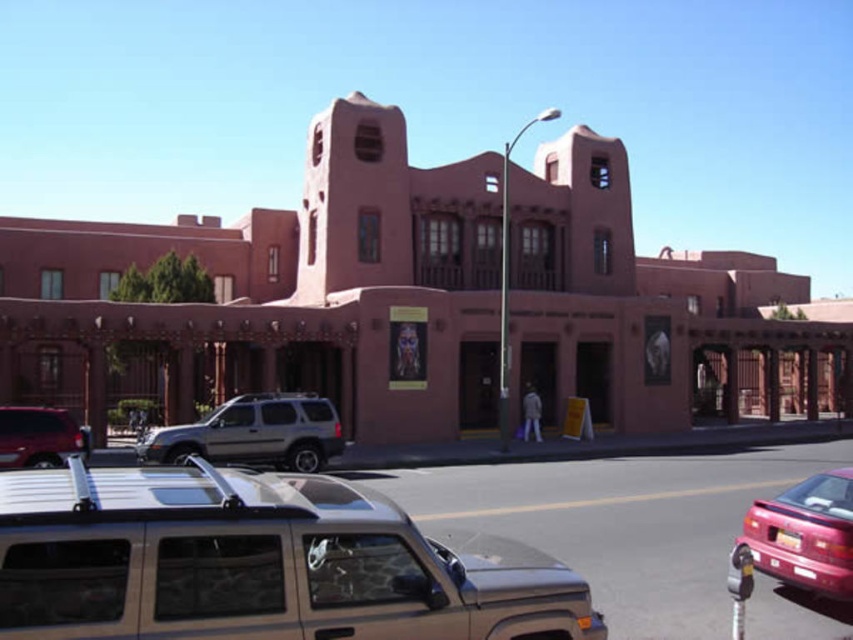
Question: Considering the relative positions of silver metallic suv at center and shiny red car at lower right in the image provided, where is silver metallic suv at center located with respect to shiny red car at lower right?

Choices:
 (A) above
 (B) below

Answer: (B)

Question: Can you confirm if silver metallic minivan at center is smaller than silver metallic suv at center?

Choices:
 (A) no
 (B) yes

Answer: (B)

Question: Which point is farther from the camera taking this photo?

Choices:
 (A) (440, 627)
 (B) (21, 424)
 (C) (260, 449)

Answer: (C)

Question: Considering the relative positions of silver metallic suv at center and matte silver suv at lower left in the image provided, where is silver metallic suv at center located with respect to matte silver suv at lower left?

Choices:
 (A) right
 (B) left

Answer: (A)

Question: Which point is farther to the camera?

Choices:
 (A) (730, 579)
 (B) (125, 611)

Answer: (A)

Question: Estimate the real-world distances between objects in this image. Which object is farther from the shiny red car at lower right?

Choices:
 (A) matte silver suv at lower left
 (B) silver metallic suv at center

Answer: (A)